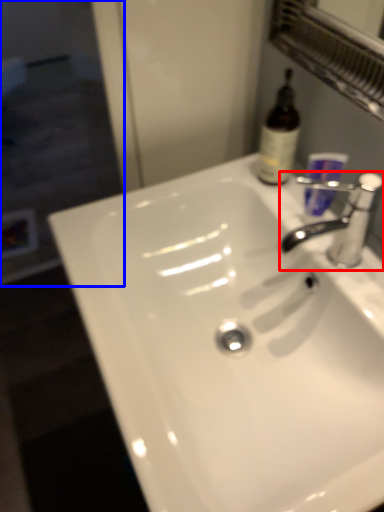
Question: Which point is closer to the camera, tap (highlighted by a red box) or screen door (highlighted by a blue box)?

Choices:
 (A) tap
 (B) screen door

Answer: (A)